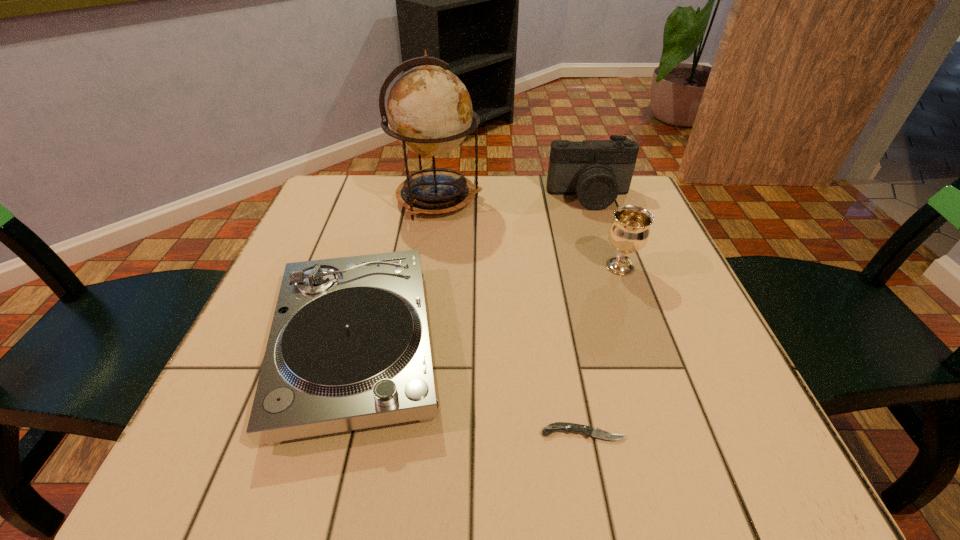
The image size is (960, 540). In the image, there is a desktop. Find the location of `free space at the near edge`. free space at the near edge is located at coordinates (324, 460).

Where is `free spot at the left edge of the desktop`? free spot at the left edge of the desktop is located at coordinates (318, 246).

What are the coordinates of `vacant space at the right edge of the desktop` in the screenshot? It's located at (705, 319).

At what (x,y) coordinates should I click in order to perform the action: click on free location at the far left corner. Please return your answer as a coordinate pair (x, y). This screenshot has height=540, width=960. Looking at the image, I should click on (348, 204).

I want to click on free point at the near right corner, so click(x=732, y=426).

You are a GUI agent. You are given a task and a screenshot of the screen. Output one action in this format:
    pyautogui.click(x=<x>, y=<y>)
    Task: Click on the free space that is in between the globe and the shortest object
    This screenshot has width=960, height=540.
    Given the screenshot: What is the action you would take?
    pyautogui.click(x=511, y=316)

Locate an element on the screen. free space that is in between the globe and the camera is located at coordinates (514, 198).

This screenshot has width=960, height=540. What are the coordinates of `blank region between the shortest object and the record player` in the screenshot? It's located at (469, 389).

This screenshot has height=540, width=960. I want to click on unoccupied area between the chalice and the record player, so pyautogui.click(x=488, y=306).

This screenshot has width=960, height=540. I want to click on free space between the globe and the pocketknife, so click(511, 316).